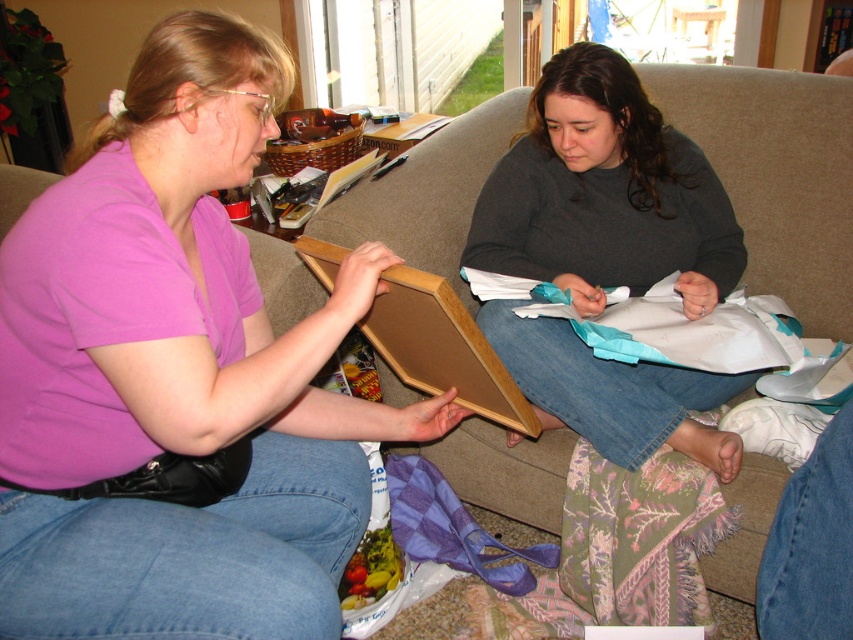
Question: Which point is closer to the camera taking this photo?

Choices:
 (A) (175, 36)
 (B) (775, 289)

Answer: (A)

Question: Based on their relative distances, which object is farther from the beige fabric couch at center?

Choices:
 (A) dark gray sweater at center
 (B) matte pink shirt at left

Answer: (B)

Question: Observing the image, what is the correct spatial positioning of matte pink shirt at left in reference to beige fabric couch at center?

Choices:
 (A) below
 (B) above

Answer: (A)

Question: Can you confirm if matte pink shirt at left is bigger than dark gray sweater at center?

Choices:
 (A) no
 (B) yes

Answer: (B)

Question: Which of the following is the closest to the observer?

Choices:
 (A) (244, 611)
 (B) (764, 259)
 (C) (726, 248)

Answer: (A)

Question: Is matte pink shirt at left below dark gray sweater at center?

Choices:
 (A) yes
 (B) no

Answer: (A)